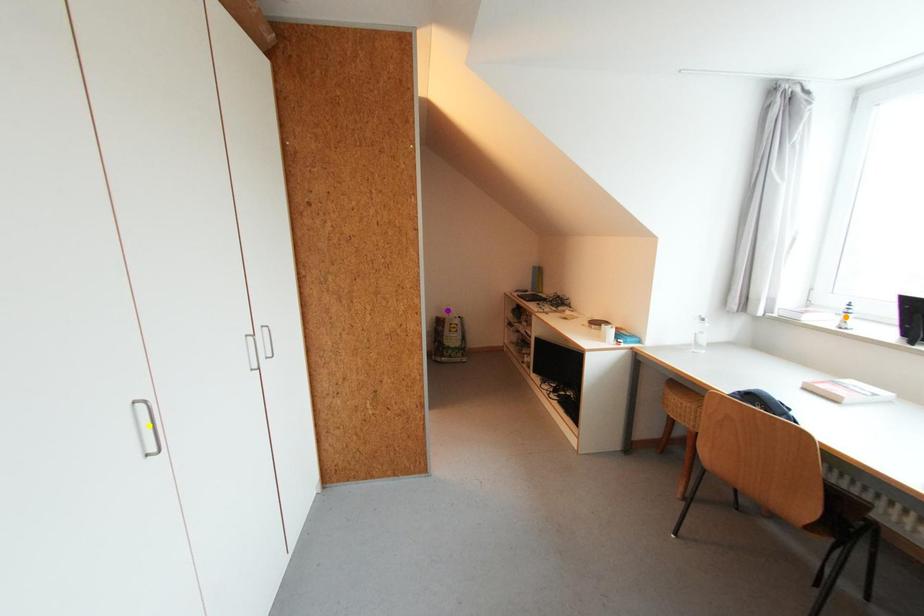
Order these from nearest to farthest:
orange point, yellow point, purple point

1. yellow point
2. orange point
3. purple point